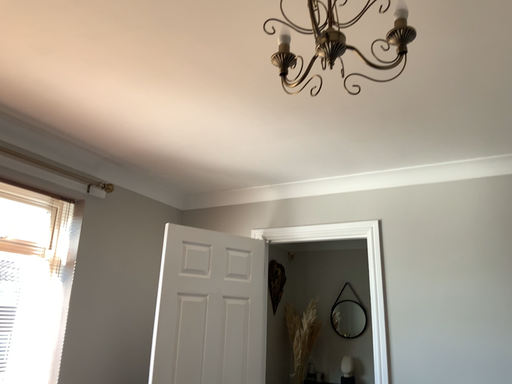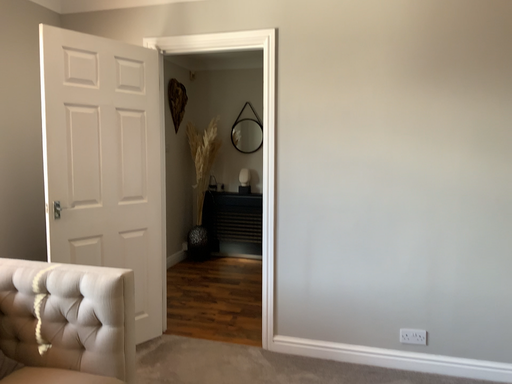
Question: How did the camera likely rotate when shooting the video?

Choices:
 (A) rotated upward
 (B) rotated downward

Answer: (B)